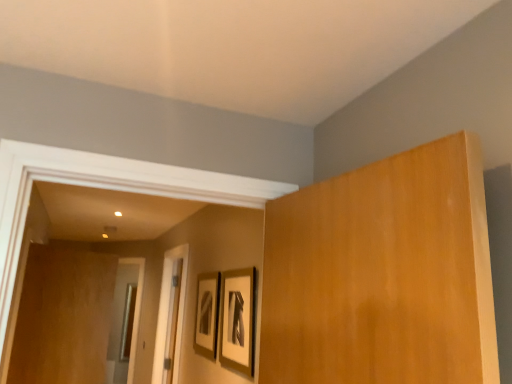
Question: Considering the relative sizes of matte black picture frame at center, the 2th picture frame when ordered from right to left, and matte black picture frame at center, positioned as the 1th picture frame in front-to-back order, in the image provided, is matte black picture frame at center, the 2th picture frame when ordered from right to left, shorter than matte black picture frame at center, positioned as the 1th picture frame in front-to-back order,?

Choices:
 (A) no
 (B) yes

Answer: (B)

Question: Considering the relative positions of matte black picture frame at center, the first picture frame in the left-to-right sequence, and matte black picture frame at center, which is the first picture frame from right to left, in the image provided, is matte black picture frame at center, the first picture frame in the left-to-right sequence, in front of matte black picture frame at center, which is the first picture frame from right to left,?

Choices:
 (A) yes
 (B) no

Answer: (B)

Question: Are matte black picture frame at center, the 2th picture frame when ordered from right to left, and matte black picture frame at center, the 2th picture frame when ordered from back to front, located far from each other?

Choices:
 (A) yes
 (B) no

Answer: (B)

Question: Does matte black picture frame at center, the 2th picture frame when ordered from right to left, turn towards matte black picture frame at center, which is the first picture frame from right to left?

Choices:
 (A) no
 (B) yes

Answer: (A)

Question: From the image's perspective, is matte black picture frame at center, the first picture frame in the left-to-right sequence, on top of matte black picture frame at center, the 2th picture frame when ordered from back to front?

Choices:
 (A) no
 (B) yes

Answer: (A)

Question: Considering the relative sizes of matte black picture frame at center, marked as the 2th picture frame in a front-to-back arrangement, and matte black picture frame at center, the 2th picture frame when ordered from back to front, in the image provided, is matte black picture frame at center, marked as the 2th picture frame in a front-to-back arrangement, wider than matte black picture frame at center, the 2th picture frame when ordered from back to front,?

Choices:
 (A) yes
 (B) no

Answer: (B)

Question: Can you confirm if matte black picture frame at center, which is the first picture frame from right to left, is bigger than brown wood door at left?

Choices:
 (A) no
 (B) yes

Answer: (A)

Question: Is matte black picture frame at center, positioned as the 1th picture frame in front-to-back order, outside of brown wood door at left?

Choices:
 (A) no
 (B) yes

Answer: (B)

Question: Is matte black picture frame at center, which is the first picture frame from right to left, wider than brown wood door at left?

Choices:
 (A) yes
 (B) no

Answer: (B)

Question: Is matte black picture frame at center, the second picture frame viewed from the left, at the left side of brown wood door at left?

Choices:
 (A) yes
 (B) no

Answer: (B)

Question: Is matte black picture frame at center, the second picture frame viewed from the left, smaller than brown wood door at left?

Choices:
 (A) yes
 (B) no

Answer: (A)

Question: Considering the relative positions of matte black picture frame at center, the second picture frame viewed from the left, and brown wood door at left in the image provided, is matte black picture frame at center, the second picture frame viewed from the left, behind brown wood door at left?

Choices:
 (A) yes
 (B) no

Answer: (B)

Question: Is brown wood door at left further to camera compared to matte black picture frame at center, the first picture frame in the left-to-right sequence?

Choices:
 (A) no
 (B) yes

Answer: (B)